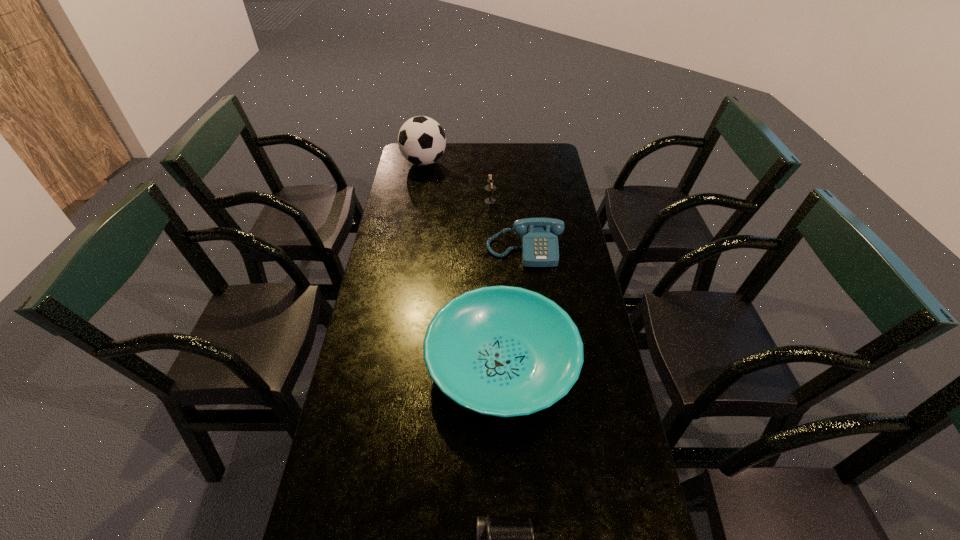
I want to click on vacant area between the soccer ball and the third farthest object, so click(x=474, y=206).

At what (x,y) coordinates should I click in order to perform the action: click on vacant space that is in between the second farthest object and the second nearest object. Please return your answer as a coordinate pair (x, y). Looking at the image, I should click on (496, 282).

Identify the location of free point between the telephone and the second tallest object. (508, 226).

Identify which object is the closest to the nearest object. Please provide its 2D coordinates. Your answer should be formatted as a tuple, i.e. [(x, y)], where the tuple contains the x and y coordinates of a point satisfying the conditions above.

[(505, 351)]

Image resolution: width=960 pixels, height=540 pixels. What are the coordinates of `object that is the second closest to the second tallest object` in the screenshot? It's located at click(x=421, y=140).